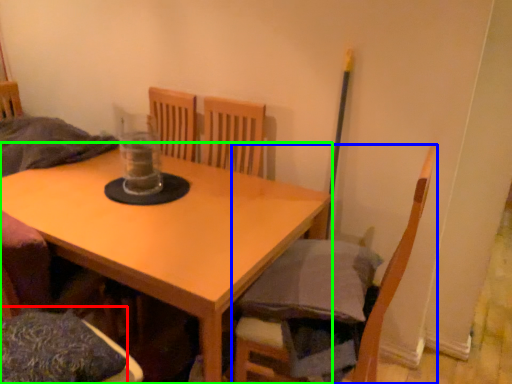
Question: Which object is positioned closest to pillow (highlighted by a red box)? Select from chair (highlighted by a blue box) and table (highlighted by a green box).

Choices:
 (A) chair
 (B) table

Answer: (B)